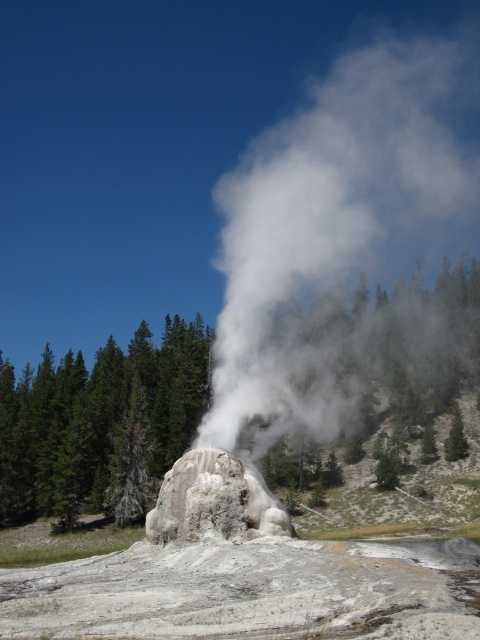
Question: Which of the following is the farthest from the observer?

Choices:
 (A) green textured tree at center
 (B) gray textured rock at center
 (C) white vapor at center

Answer: (A)

Question: Does white vapor at center have a larger size compared to gray textured rock at center?

Choices:
 (A) no
 (B) yes

Answer: (B)

Question: Can you confirm if white vapor at center is positioned to the right of gray textured rock at center?

Choices:
 (A) yes
 (B) no

Answer: (A)

Question: Which object is farther from the camera taking this photo?

Choices:
 (A) green textured tree at center
 (B) gray textured rock at center

Answer: (A)

Question: Does white vapor at center have a larger size compared to gray textured rock at center?

Choices:
 (A) yes
 (B) no

Answer: (A)

Question: Which object is closer to the camera taking this photo?

Choices:
 (A) gray textured rock at center
 (B) white vapor at center
 (C) green textured tree at center

Answer: (A)